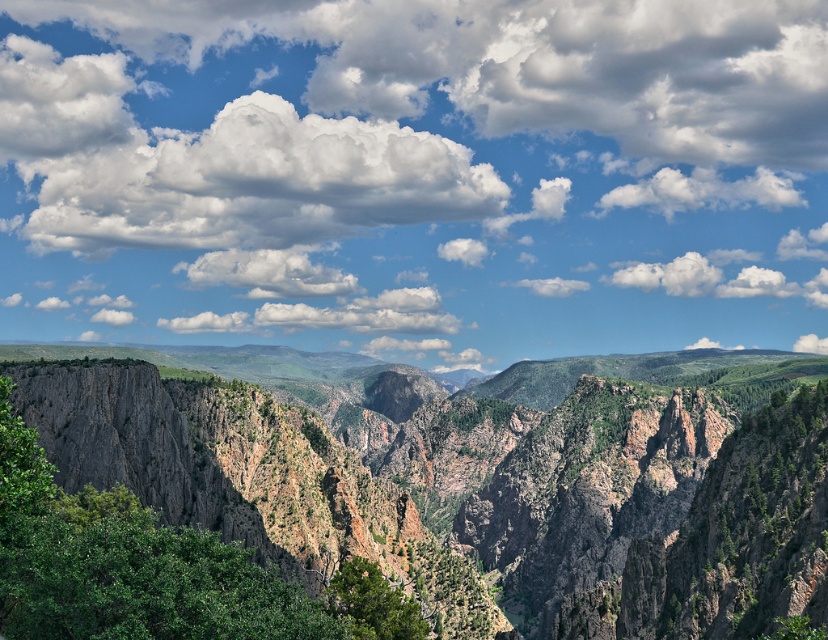
Does white fluffy cloud at upper center have a greater width compared to rugged rock canyon at center?

Yes.

This screenshot has width=828, height=640. What do you see at coordinates (415, 176) in the screenshot?
I see `white fluffy cloud at upper center` at bounding box center [415, 176].

Which is behind, point (193, 150) or point (42, 404)?

Point (193, 150)

You are a GUI agent. You are given a task and a screenshot of the screen. Output one action in this format:
    pyautogui.click(x=<x>, y=<y>)
    Task: Click on the white fluffy cloud at upper center
    This screenshot has height=640, width=828.
    Given the screenshot: What is the action you would take?
    pyautogui.click(x=415, y=176)

Does point (75, 369) come closer to viewer compared to point (366, 628)?

No, it is behind (366, 628).

From the picture: Between rugged rock canyon at center and green textured tree at lower center, which one is positioned lower?

rugged rock canyon at center

Between point (219, 461) and point (398, 595), which one is positioned in front?

Point (398, 595) is in front.

Image resolution: width=828 pixels, height=640 pixels. Identify the location of rugged rock canyon at center. (490, 484).

Who is lower down, rugged rock canyon at center or green leafy tree at center?

rugged rock canyon at center

Who is positioned more to the right, rugged rock canyon at center or green leafy tree at center?

rugged rock canyon at center is more to the right.

Who is more forward, (694,444) or (153,625)?

Point (153,625)

The width and height of the screenshot is (828, 640). What are the coordinates of `rugged rock canyon at center` in the screenshot? It's located at (490, 484).